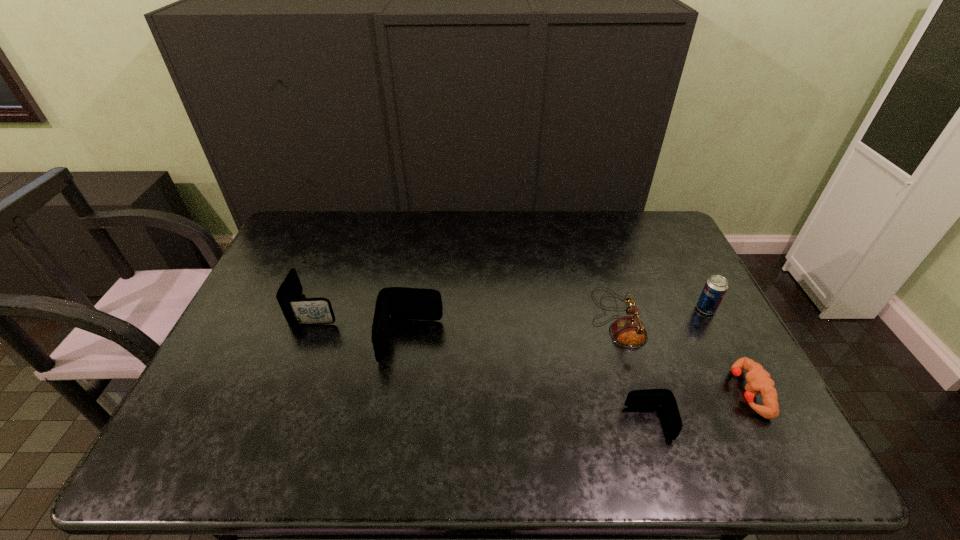
Locate an element on the screen. vacant space situated 0.350m on the outer surface of the rightmost wallet is located at coordinates (477, 423).

Image resolution: width=960 pixels, height=540 pixels. Find the location of `free space located 0.180m on the outer surface of the rightmost wallet`. free space located 0.180m on the outer surface of the rightmost wallet is located at coordinates (550, 423).

Find the location of a particular element. free space located on the outer surface of the rightmost wallet is located at coordinates (498, 423).

You are a GUI agent. You are given a task and a screenshot of the screen. Output one action in this format:
    pyautogui.click(x=<x>, y=<y>)
    Task: Click on the free space located on the front of the beer can
    
    Given the screenshot: What is the action you would take?
    pyautogui.click(x=756, y=404)

This screenshot has width=960, height=540. Identify the location of vacant space positioned 0.150m on the rotary dial of the telephone. (540, 318).

Locate an element on the screen. The width and height of the screenshot is (960, 540). vacant position located 0.280m on the rotary dial of the telephone is located at coordinates (494, 318).

Where is `blank area located on the rotary dial of the telephone`? This screenshot has height=540, width=960. blank area located on the rotary dial of the telephone is located at coordinates (464, 318).

Locate an element on the screen. Image resolution: width=960 pixels, height=540 pixels. vacant space located 0.270m with the gloves of the puncher facing forward is located at coordinates (623, 392).

You are a GUI agent. You are given a task and a screenshot of the screen. Output one action in this format:
    pyautogui.click(x=<x>, y=<y>)
    Task: Click on the vacant space located 0.280m with the gloves of the puncher facing forward
    Image resolution: width=960 pixels, height=540 pixels.
    Given the screenshot: What is the action you would take?
    pyautogui.click(x=619, y=392)

Where is `vacant region located with the gloves of the puncher facing forward`? The height and width of the screenshot is (540, 960). vacant region located with the gloves of the puncher facing forward is located at coordinates (615, 392).